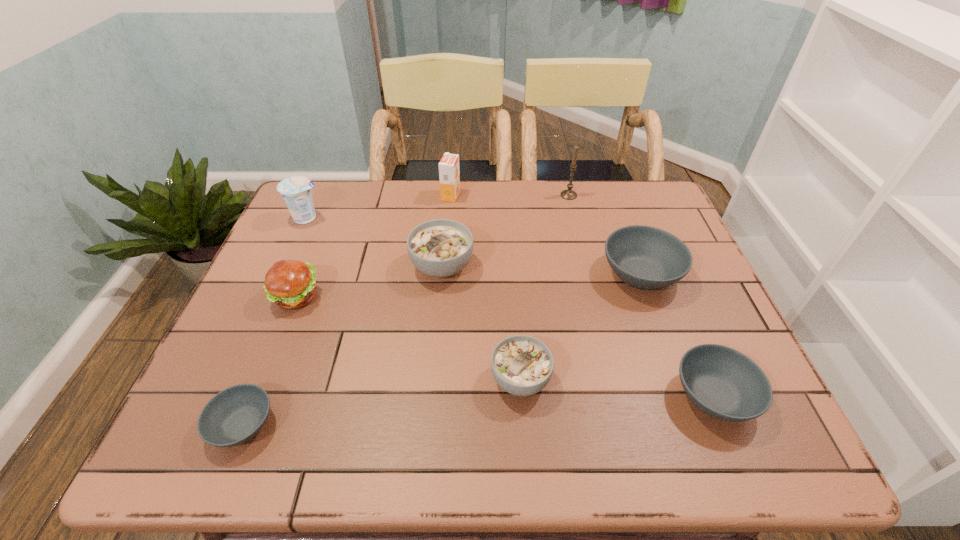
Identify the location of vacant space that is in between the blue yogurt and the fourth soup bowl from right to left. (375, 242).

Locate an element on the screen. free space that is in between the right white soup bowl and the yogurt is located at coordinates (414, 299).

The width and height of the screenshot is (960, 540). What are the coordinates of `vacant area that lies between the farthest gray soup bowl and the second shortest soup bowl` in the screenshot? It's located at (677, 335).

Find the location of a particular element. Image resolution: width=960 pixels, height=540 pixels. free space between the gray candle and the second shortest soup bowl is located at coordinates (641, 295).

Where is `free space between the fourth tallest soup bowl and the farthest gray soup bowl`? The width and height of the screenshot is (960, 540). free space between the fourth tallest soup bowl and the farthest gray soup bowl is located at coordinates (677, 335).

Find the location of a particular element. The width and height of the screenshot is (960, 540). vacant point located between the blue yogurt and the hamburger is located at coordinates point(301,257).

Where is `vacant area between the biggest gray soup bowl and the second shortest soup bowl`? vacant area between the biggest gray soup bowl and the second shortest soup bowl is located at coordinates (677, 335).

You are a GUI agent. You are given a task and a screenshot of the screen. Output one action in this format:
    pyautogui.click(x=<x>, y=<y>)
    Task: Click on the free space between the yogurt and the farther white soup bowl
    The image size is (960, 540).
    Given the screenshot: What is the action you would take?
    pyautogui.click(x=375, y=242)

This screenshot has height=540, width=960. I want to click on unoccupied area between the candle and the farthest gray soup bowl, so click(605, 234).

At what (x,y) coordinates should I click in order to perform the action: click on the third closest object to the hamburger. Please return your answer as a coordinate pair (x, y). The image size is (960, 540). Looking at the image, I should click on (236, 414).